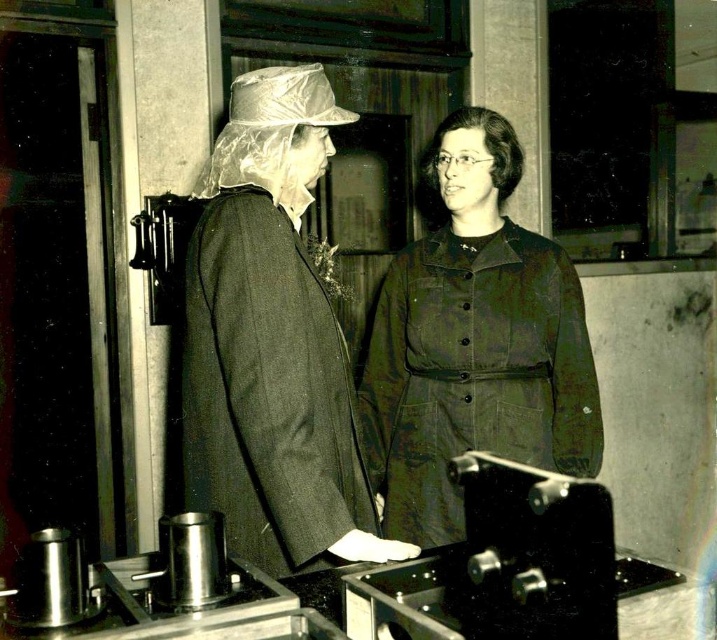
Does matte black coat at center appear on the right side of olive green fabric coat at center?

Incorrect, matte black coat at center is not on the right side of olive green fabric coat at center.

Between matte black coat at center and olive green fabric coat at center, which one appears on the left side from the viewer's perspective?

Positioned to the left is matte black coat at center.

Where is `matte black coat at center`? This screenshot has height=640, width=717. matte black coat at center is located at coordinates (270, 340).

Find the location of a particular element. The height and width of the screenshot is (640, 717). matte black coat at center is located at coordinates (270, 340).